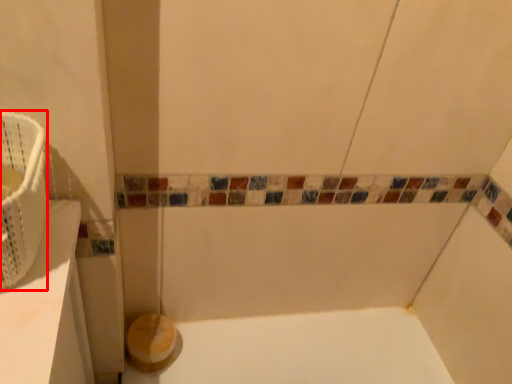
Question: From the image's perspective, what is the correct spatial relationship of basket (annotated by the red box) in relation to toilet paper?

Choices:
 (A) below
 (B) above

Answer: (B)